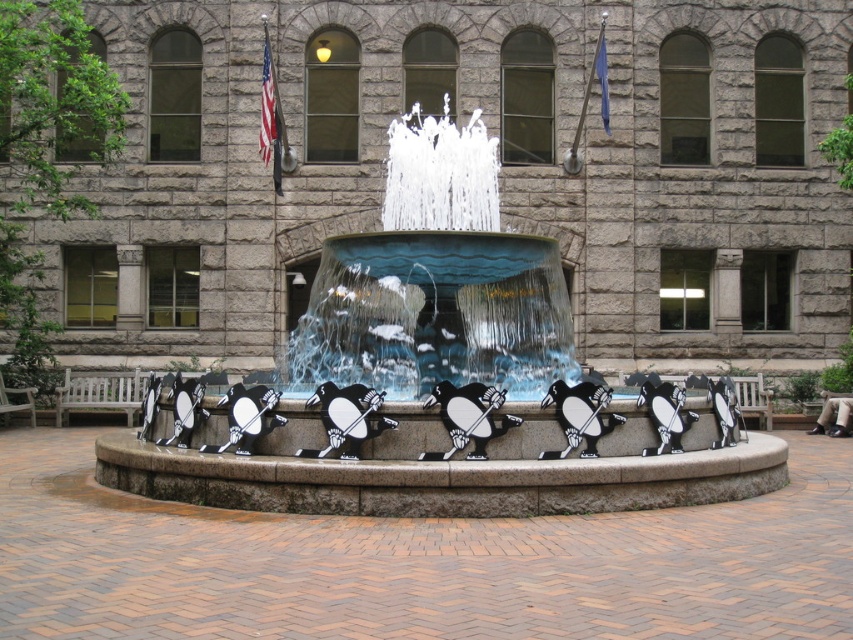
In the scene shown: You are a visitor at the fountain and want to take a photo of the white glossy water at center and the blue glass water at center. Which one is closer to the camera lens?

The blue glass water at center is closer to the camera lens because the white glossy water at center is positioned under it.

You are a photographer standing at the front of the large stone building with arched windows. You want to capture a photo of both the white glossy water at center and the blue glass water at center in the same frame. Which one should you adjust your camera angle to focus on first to ensure both are visible?

The white glossy water at center is positioned on the left side of blue glass water at center. To capture both in the same frame, focus on the white glossy water at center first as it is on the left, then adjust the angle to include the blue glass water at center on the right.